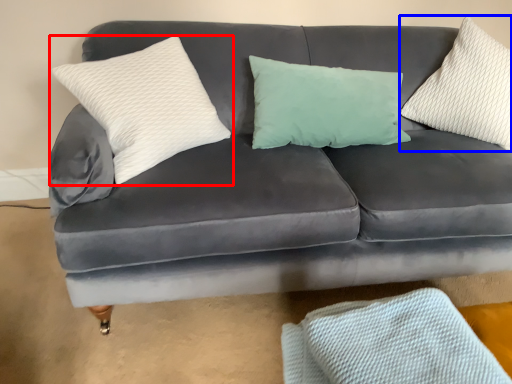
Question: Which object is further to the camera taking this photo, pillow (highlighted by a red box) or pillow (highlighted by a blue box)?

Choices:
 (A) pillow
 (B) pillow

Answer: (B)